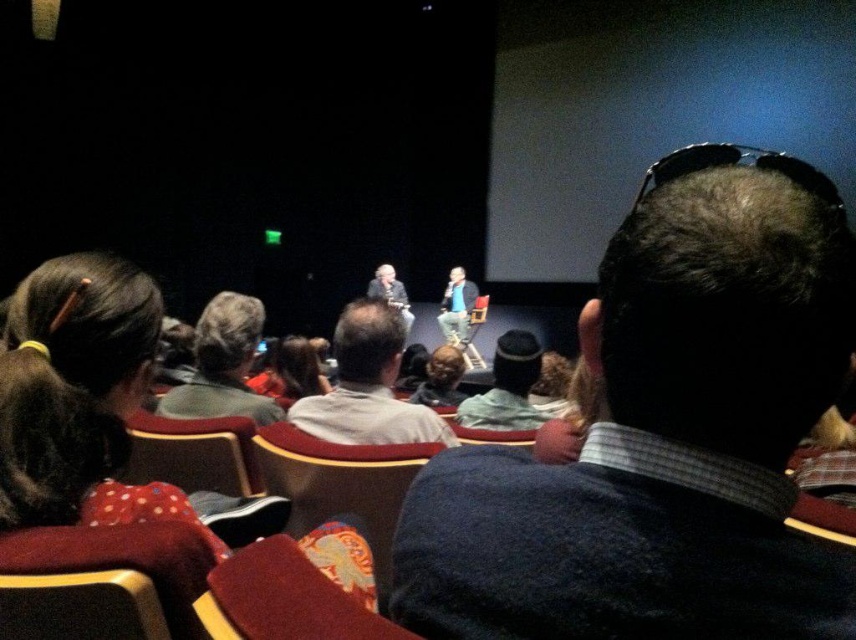
Question: Among these points, which one is farthest from the camera?

Choices:
 (A) (224, 387)
 (B) (128, 314)
 (C) (349, 400)
 (D) (381, 516)

Answer: (A)

Question: Is dark blue sweater at center smaller than velvet red chair at lower left?

Choices:
 (A) yes
 (B) no

Answer: (B)

Question: Is velvet red chair at lower left further to camera compared to knitted wool hat at center?

Choices:
 (A) no
 (B) yes

Answer: (A)

Question: Which point is closer to the camera?

Choices:
 (A) (501, 337)
 (B) (387, 637)

Answer: (B)

Question: Can you confirm if velvet-like red chair at lower center is positioned above velvet red chair at lower left?

Choices:
 (A) yes
 (B) no

Answer: (A)

Question: Which is nearer to the gray wool sweater at center?

Choices:
 (A) dark gray suit at center
 (B) velvet cushioned chair at center
 (C) velvet red chair at lower left
 (D) dark blue sweater at center

Answer: (B)